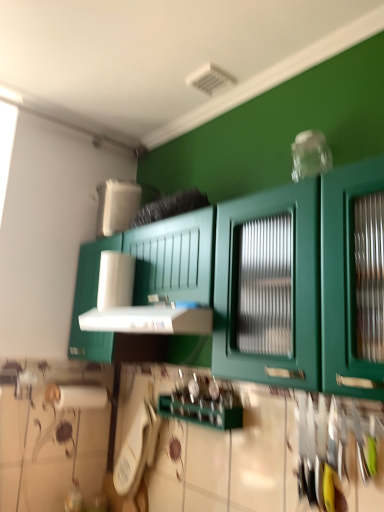
What is the approximate height of green matte cabinet at center?

green matte cabinet at center is 37.69 inches tall.

This screenshot has height=512, width=384. I want to click on green matte cabinet at center, so click(304, 284).

Does white plastic vent at center appear on the right side of green matte cabinet at center?

No.

Is white plastic vent at center not within green matte cabinet at center?

No, white plastic vent at center is not outside of green matte cabinet at center.

Based on the photo, from the image's perspective, would you say white plastic vent at center is shown under green matte cabinet at center?

Yes, from the image's perspective, white plastic vent at center is beneath green matte cabinet at center.

Considering the relative sizes of white plastic vent at center and green matte cabinet at center in the image provided, is white plastic vent at center smaller than green matte cabinet at center?

Yes, white plastic vent at center is smaller than green matte cabinet at center.

Which of these two, white plastic phone at lower center or white plastic vent at center, is bigger?

With larger size is white plastic vent at center.

From the image's perspective, is white plastic phone at lower center over white plastic vent at center?

Actually, white plastic phone at lower center appears below white plastic vent at center in the image.

Is white plastic vent at center located within white plastic phone at lower center?

No.

Can you see white plastic phone at lower center touching white plastic vent at center?

No, white plastic phone at lower center is not making contact with white plastic vent at center.

Find the location of `appliance that is on the left side of green matte cabinet at center`. appliance that is on the left side of green matte cabinet at center is located at coordinates (137, 450).

Is green matte cabinet at center located within white plastic phone at lower center?

Actually, green matte cabinet at center is outside white plastic phone at lower center.

From the image's perspective, which is below, white plastic phone at lower center or green matte cabinet at center?

white plastic phone at lower center.

Considering the relative sizes of white plastic phone at lower center and green matte cabinet at center in the image provided, is white plastic phone at lower center smaller than green matte cabinet at center?

Indeed, white plastic phone at lower center has a smaller size compared to green matte cabinet at center.

Does green matte cabinet at center have a lesser width compared to white plastic phone at lower center?

No.

Which of these two, green matte cabinet at center or white plastic phone at lower center, is smaller?

white plastic phone at lower center is smaller.

Is point (360, 272) closer to viewer compared to point (131, 438)?

Yes, point (360, 272) is in front of point (131, 438).

Which object is positioned more to the right, green matte cabinet at center or white plastic phone at lower center?

Positioned to the right is green matte cabinet at center.

Is green matte cabinet at center looking in the opposite direction of white plastic vent at center?

Yes.

Between point (260, 370) and point (134, 331), which one is positioned in front?

Positioned in front is point (260, 370).

Is green matte cabinet at center touching white plastic vent at center?

No.

From a real-world perspective, which is physically above, green matte cabinet at center or white plastic vent at center?

From a 3D spatial view, green matte cabinet at center is above.

From a real-world perspective, is white plastic vent at center positioned above or below white plastic phone at lower center?

white plastic vent at center is situated higher than white plastic phone at lower center in the real world.

Considering the sizes of objects white plastic vent at center and white plastic phone at lower center in the image provided, who is shorter, white plastic vent at center or white plastic phone at lower center?

white plastic vent at center is shorter.

Is white plastic vent at center directly adjacent to white plastic phone at lower center?

white plastic vent at center is not next to white plastic phone at lower center, and they're not touching.

Which is behind, point (107, 328) or point (156, 440)?

The point (156, 440) is more distant.

This screenshot has width=384, height=512. Identify the location of vent on the left of green matte cabinet at center. (149, 320).

The width and height of the screenshot is (384, 512). Identify the location of vent to the right of white plastic phone at lower center. (149, 320).

Estimate the real-world distances between objects in this image. Which object is closer to white plastic vent at center, white plastic phone at lower center or green matte cabinet at center?

Among the two, green matte cabinet at center is located nearer to white plastic vent at center.

Considering their positions, is white plastic vent at center positioned further to white plastic phone at lower center than green matte cabinet at center?

Among the two, green matte cabinet at center is located further to white plastic phone at lower center.

When comparing their distances from green matte cabinet at center, does white plastic vent at center or white plastic phone at lower center seem further?

Among the two, white plastic phone at lower center is located further to green matte cabinet at center.

Considering their positions, is green matte cabinet at center positioned further to white plastic vent at center than white plastic phone at lower center?

white plastic phone at lower center is positioned further to the anchor white plastic vent at center.

Looking at the image, which one is located closer to green matte cabinet at center, white plastic phone at lower center or white plastic vent at center?

white plastic vent at center.

Looking at the image, which one is located further to white plastic phone at lower center, green matte cabinet at center or white plastic vent at center?

Among the two, green matte cabinet at center is located further to white plastic phone at lower center.

Find the location of a particular element. The width and height of the screenshot is (384, 512). vent located between green matte cabinet at center and white plastic phone at lower center in the depth direction is located at coordinates (149, 320).